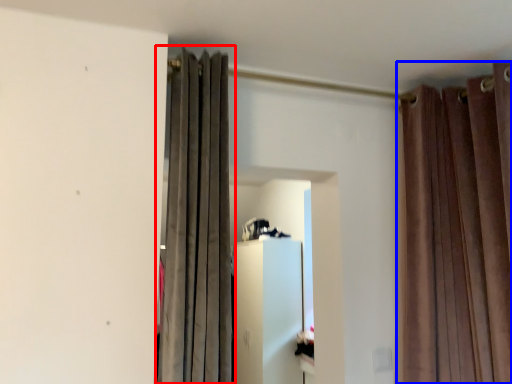
Question: Among these objects, which one is nearest to the camera, curtain (highlighted by a red box) or curtain (highlighted by a blue box)?

Choices:
 (A) curtain
 (B) curtain

Answer: (A)